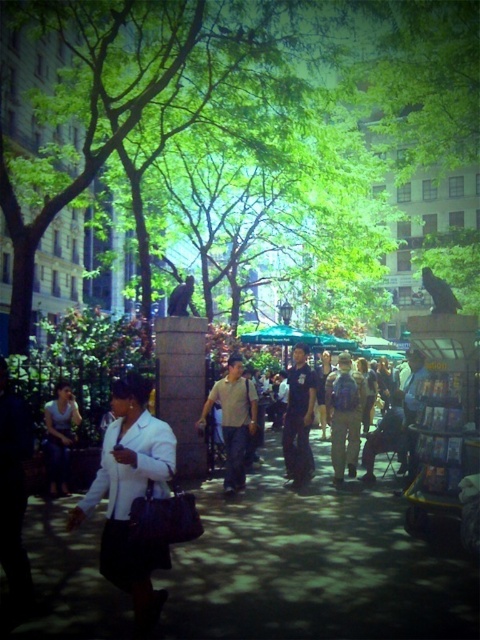
Does dark blue backpack at center have a larger size compared to matte black backpack at center?

Yes.

Between dark blue backpack at center and matte black backpack at center, which one is positioned lower?

matte black backpack at center

Does point (334, 380) come closer to viewer compared to point (409, 406)?

No, it is behind (409, 406).

Where is `dark blue backpack at center`? This screenshot has height=640, width=480. dark blue backpack at center is located at coordinates [x=344, y=417].

Image resolution: width=480 pixels, height=640 pixels. Find the location of `dark brown backpack at center`. dark brown backpack at center is located at coordinates (398, 422).

Does dark brown backpack at center appear on the right side of dark blue backpack at center?

Indeed, dark brown backpack at center is positioned on the right side of dark blue backpack at center.

Is point (408, 404) in front of point (355, 381)?

Yes, it is in front of point (355, 381).

The image size is (480, 640). I want to click on dark brown backpack at center, so click(398, 422).

Who is taller, dark blue uniform at center or white shirt at center?

Standing taller between the two is dark blue uniform at center.

From the picture: Can you confirm if dark blue uniform at center is positioned below white shirt at center?

Actually, dark blue uniform at center is above white shirt at center.

Is point (288, 401) behind point (56, 460)?

Yes, point (288, 401) is behind point (56, 460).

The height and width of the screenshot is (640, 480). I want to click on dark blue uniform at center, so [x=299, y=419].